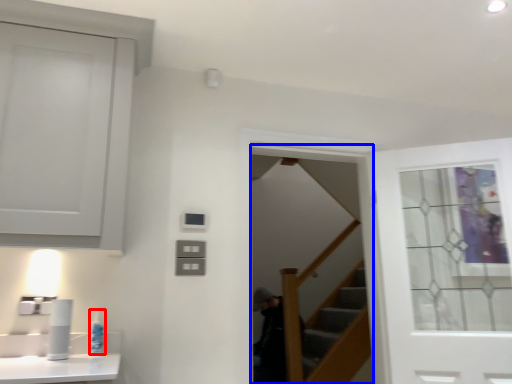
Question: Which object appears farthest to the camera in this image, toiletry (highlighted by a red box) or screen door (highlighted by a blue box)?

Choices:
 (A) toiletry
 (B) screen door

Answer: (B)